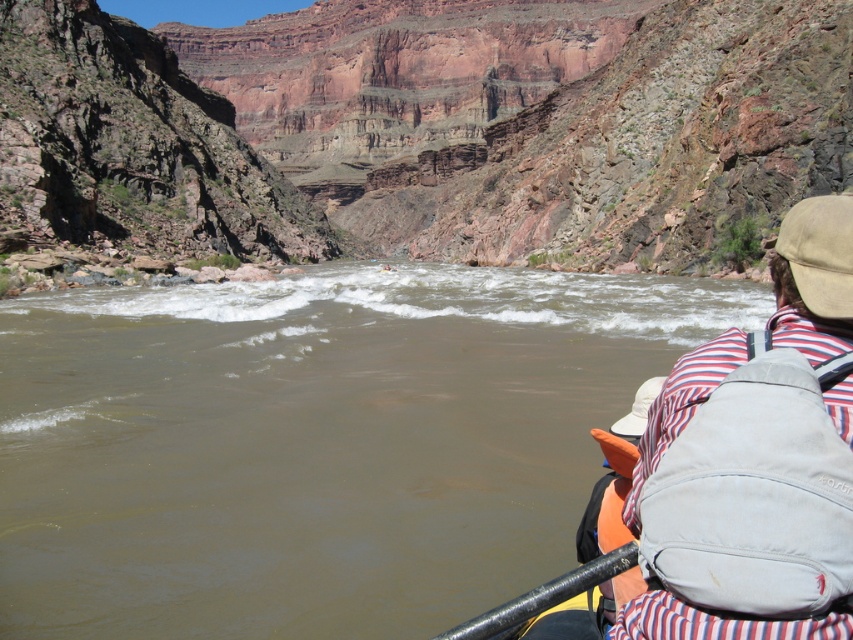
You are a photographer planning to capture a wide shot of the canyon river scene. The camera you are using has a maximum focus range of 100 meters. Given the scene described, will the point at coordinates point (672, 307) be within the camera focus range?

The point at coordinates point (672, 307) is 109.01 meters away from the camera, which exceeds the maximum focus range of 100 meters. Therefore, the camera will not be able to focus on that point.

You are a photographer positioned at the edge of the canyon river. You want to take a photo of two points in the scene, point A at coordinates point (525, 424) and point B at coordinates point (363, 214). Which point is closer to your camera?

Point point (525, 424) is closer to the viewer than point point (363, 214).